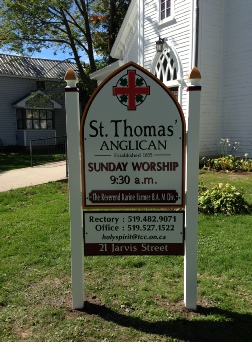
The height and width of the screenshot is (342, 252). Find the location of `windows`. windows is located at coordinates (35, 119), (165, 9).